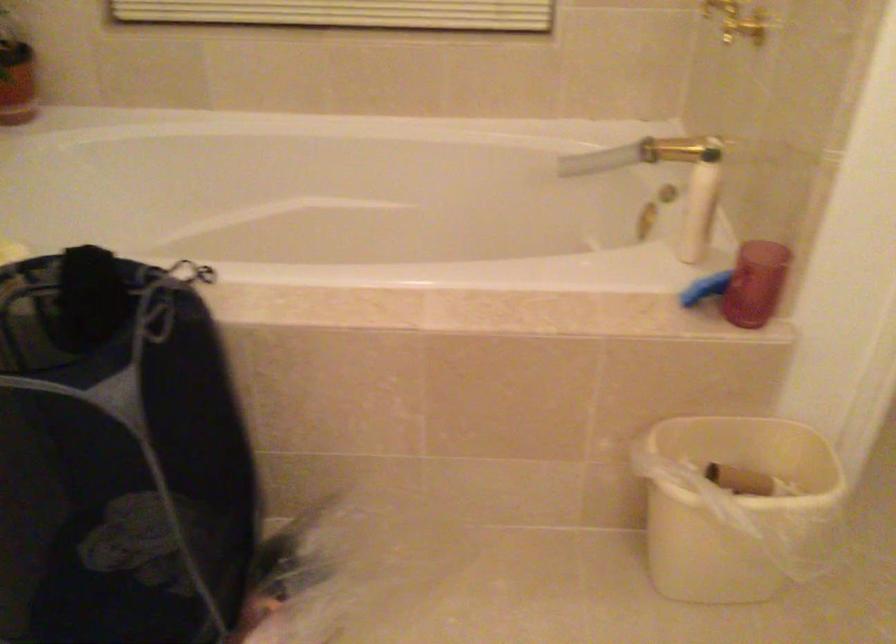
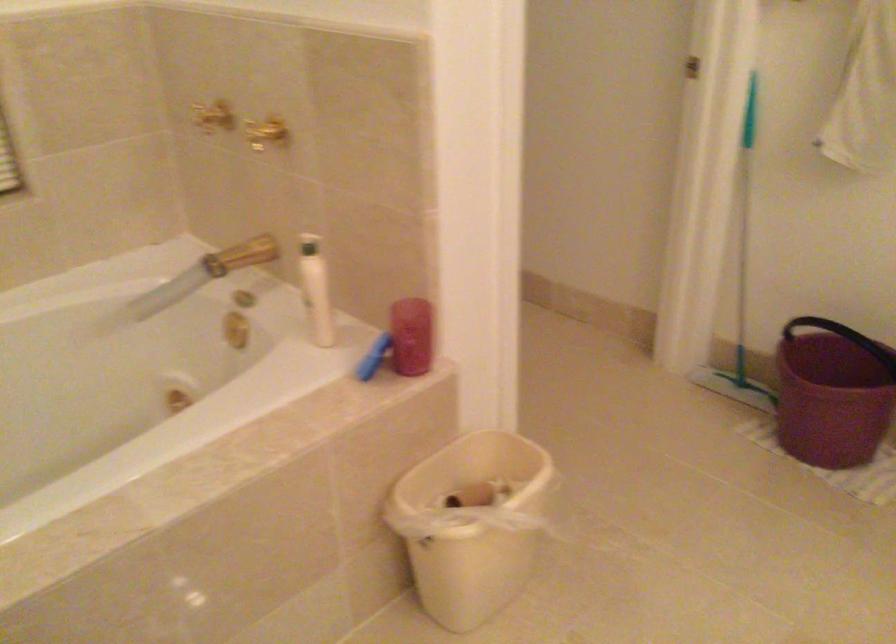
In the second image, find the point that corresponds to the point at 702,496 in the first image.

(471, 524)